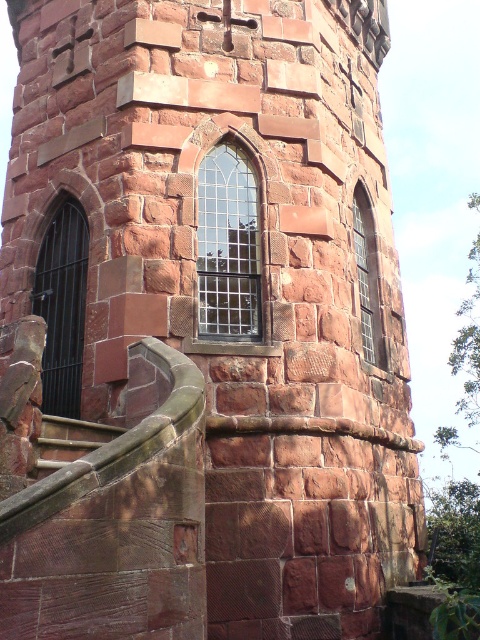
Is clear glass window at center shorter than brown stone stairs at lower left?

Incorrect, clear glass window at center's height does not fall short of brown stone stairs at lower left's.

Does clear glass window at center appear under brown stone stairs at lower left?

No.

Locate an element on the screen. clear glass window at center is located at coordinates tap(228, 244).

The image size is (480, 640). I want to click on clear glass window at center, so click(x=228, y=244).

What do you see at coordinates (228, 244) in the screenshot? I see `clear glass window at center` at bounding box center [228, 244].

This screenshot has height=640, width=480. What do you see at coordinates (228, 244) in the screenshot?
I see `clear glass window at center` at bounding box center [228, 244].

You are a GUI agent. You are given a task and a screenshot of the screen. Output one action in this format:
    pyautogui.click(x=<x>, y=<y>)
    Task: Click on the clear glass window at center
    The width and height of the screenshot is (480, 640).
    Given the screenshot: What is the action you would take?
    (228, 244)

Is point (39, 291) positioned behind point (48, 460)?

Yes, point (39, 291) is behind point (48, 460).

What do you see at coordinates (62, 307) in the screenshot?
I see `black metal window at left` at bounding box center [62, 307].

Where is `black metal window at left`? black metal window at left is located at coordinates (62, 307).